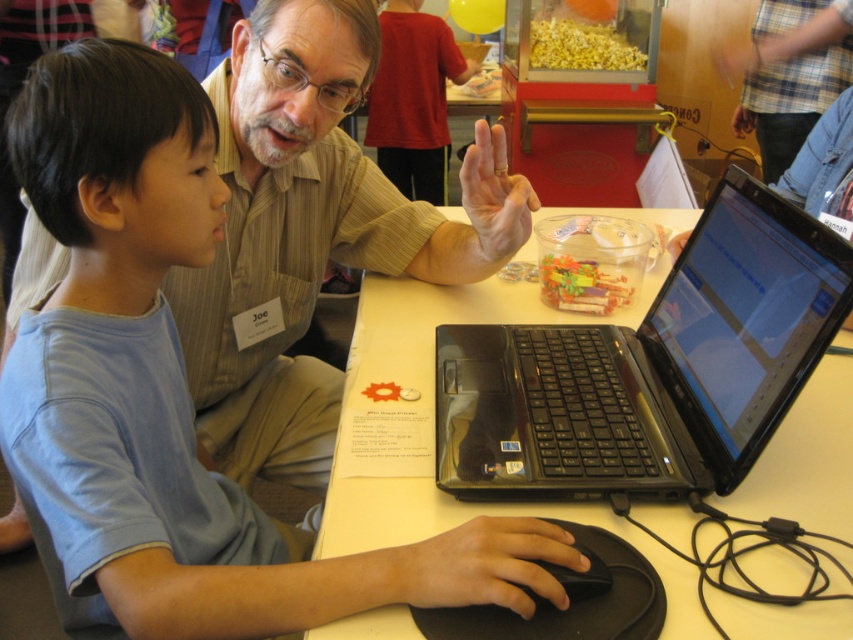
Consider the image. You are a photographer taking a picture of the scene. You want to ensure both the light blue cotton shirt at center and the black matte mouse at lower center are clearly visible in your shot. Based on their positions, which object should you focus on first to ensure both are in focus?

Since the light blue cotton shirt at center is to the left of the black matte mouse at lower center, you should focus on the light blue cotton shirt at center first as it is closer to the camera, ensuring both objects remain in focus.

You are standing at the camera position and want to reach the point at coordinates (741, 387). If you can stretch your arm 28 inches, will you be able to reach that point?

The point at coordinates (741, 387) is 31.85 inches away from the camera. Since your arm can only stretch 28 inches, you cannot reach it.

You are organizing a small tech workshop for children. You have a black plastic laptop at center and a white glossy table at center. Based on the scene description, which object is shorter?

The black plastic laptop at center is shorter than the white glossy table at center.